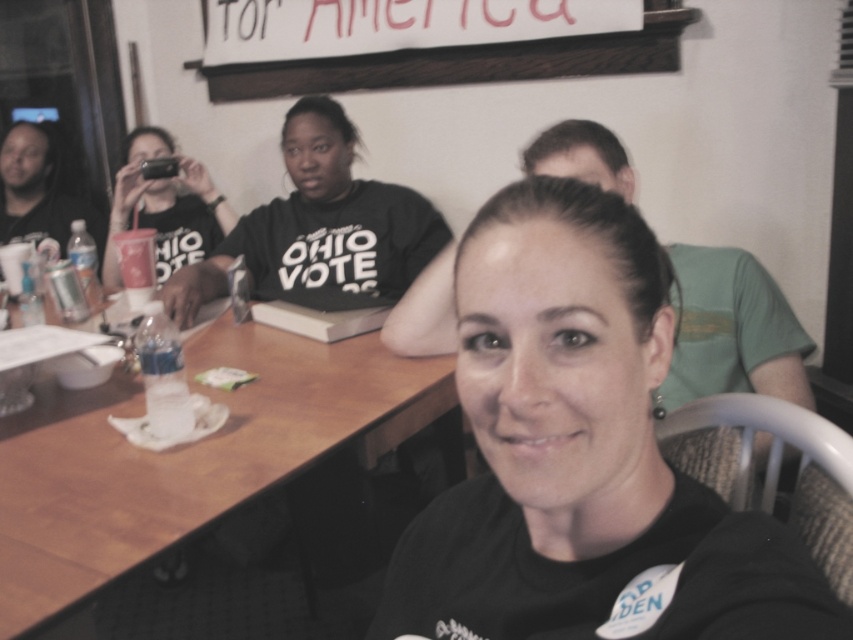
Can you confirm if wooden table at center is positioned to the left of matte black phone at upper left?

Incorrect, wooden table at center is not on the left side of matte black phone at upper left.

This screenshot has width=853, height=640. What do you see at coordinates (186, 456) in the screenshot? I see `wooden table at center` at bounding box center [186, 456].

In order to click on wooden table at center in this screenshot , I will do `click(186, 456)`.

Is black matte shirt at upper center taller than matte black phone at upper left?

Indeed, black matte shirt at upper center has a greater height compared to matte black phone at upper left.

Where is `black matte shirt at upper center`? black matte shirt at upper center is located at coordinates (318, 228).

Does black matte shirt at center lie behind black matte shirt at upper center?

No, black matte shirt at center is in front of black matte shirt at upper center.

Is point (755, 577) behind point (404, 208)?

That is False.

Locate an element on the screen. This screenshot has height=640, width=853. black matte shirt at center is located at coordinates (582, 456).